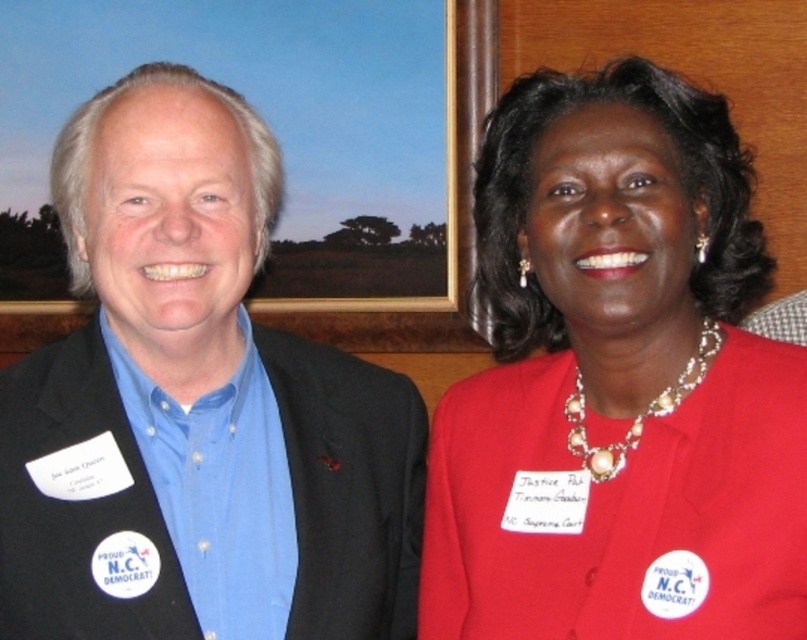
Question: Is matte red blazer at center above blue fabric shirt at center?

Choices:
 (A) no
 (B) yes

Answer: (B)

Question: Which object is farther from the camera taking this photo?

Choices:
 (A) matte red blazer at center
 (B) blue fabric shirt at center

Answer: (B)

Question: Which point is farther to the camera?

Choices:
 (A) (168, 364)
 (B) (507, 205)

Answer: (A)

Question: Does matte red blazer at center have a lesser width compared to blue fabric shirt at center?

Choices:
 (A) no
 (B) yes

Answer: (B)

Question: Can you confirm if matte red blazer at center is positioned below blue fabric shirt at center?

Choices:
 (A) no
 (B) yes

Answer: (A)